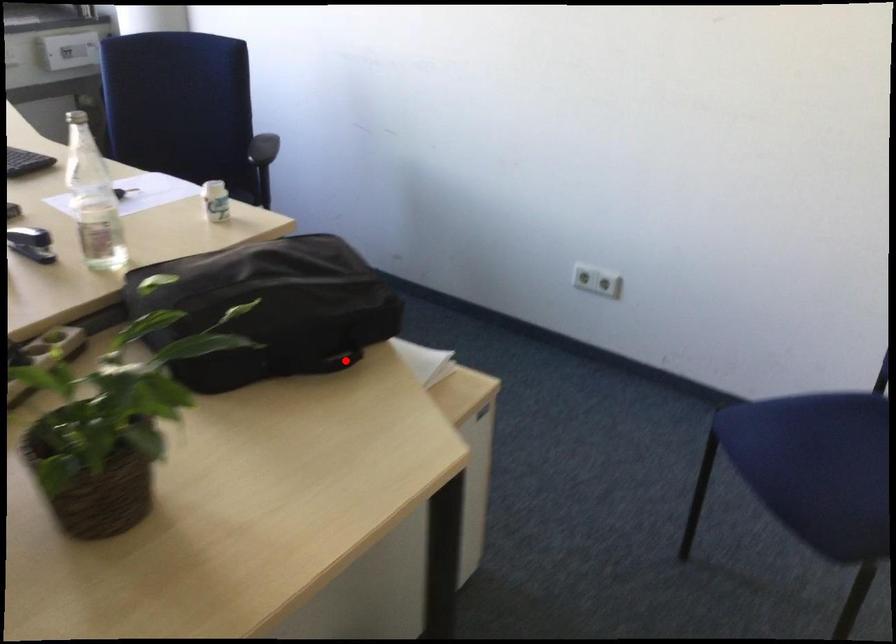
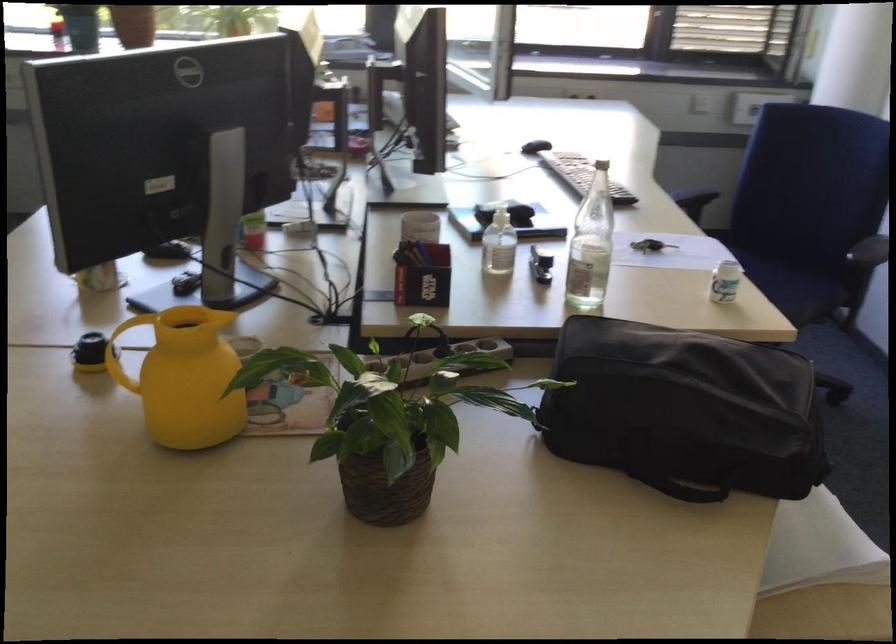
Question: I am providing you with two images of the same scene from different viewpoints. A red point is shown in image1. For the corresponding object point in image2, is it positioned nearer or farther from the camera?

Choices:
 (A) Nearer
 (B) Farther

Answer: (A)